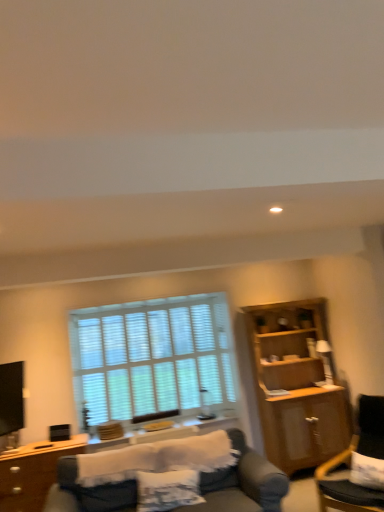
Question: From a real-world perspective, is wooden side table at lower center physically above dark gray fabric chair at lower right?

Choices:
 (A) no
 (B) yes

Answer: (B)

Question: Does wooden side table at lower center have a lesser width compared to dark gray fabric chair at lower right?

Choices:
 (A) yes
 (B) no

Answer: (A)

Question: Does wooden side table at lower center have a greater height compared to dark gray fabric chair at lower right?

Choices:
 (A) yes
 (B) no

Answer: (B)

Question: Considering the relative sizes of wooden side table at lower center and dark gray fabric chair at lower right in the image provided, is wooden side table at lower center bigger than dark gray fabric chair at lower right?

Choices:
 (A) yes
 (B) no

Answer: (B)

Question: From the image's perspective, is wooden side table at lower center above dark gray fabric chair at lower right?

Choices:
 (A) no
 (B) yes

Answer: (A)

Question: Is wooden side table at lower center closer to the viewer compared to dark gray fabric chair at lower right?

Choices:
 (A) yes
 (B) no

Answer: (B)

Question: Is white wood blinds at center at the back of wooden cabinet at right?

Choices:
 (A) yes
 (B) no

Answer: (B)

Question: From the image's perspective, is wooden cabinet at right beneath white wood blinds at center?

Choices:
 (A) no
 (B) yes

Answer: (B)

Question: Is the depth of wooden cabinet at right less than that of white wood blinds at center?

Choices:
 (A) yes
 (B) no

Answer: (A)

Question: Can you confirm if wooden cabinet at right is positioned to the left of white wood blinds at center?

Choices:
 (A) no
 (B) yes

Answer: (A)

Question: Is wooden cabinet at right far away from white wood blinds at center?

Choices:
 (A) yes
 (B) no

Answer: (A)

Question: Is wooden cabinet at right bigger than white wood blinds at center?

Choices:
 (A) yes
 (B) no

Answer: (A)

Question: Is dark gray fabric chair at lower right oriented away from wooden side table at lower center?

Choices:
 (A) yes
 (B) no

Answer: (B)